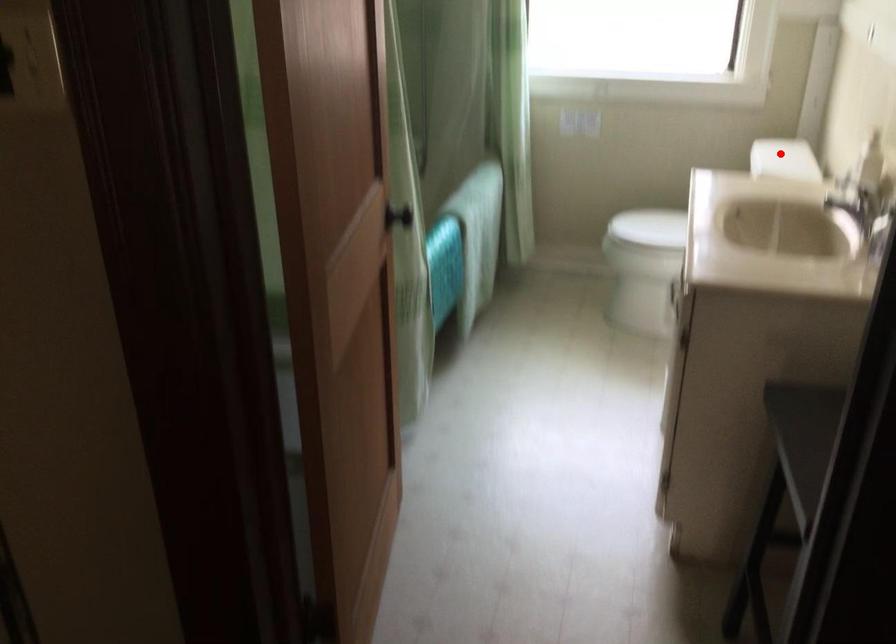
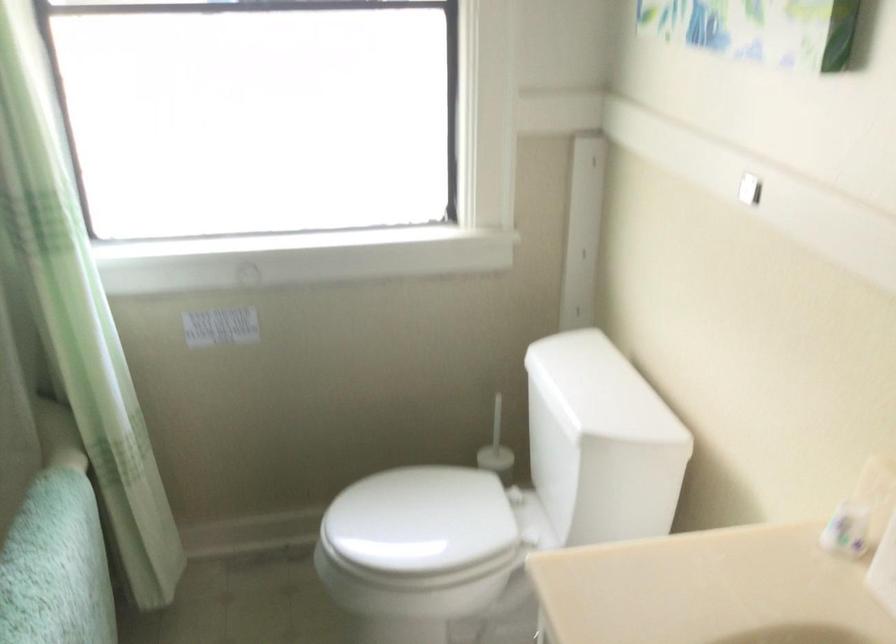
Question: I am providing you with two images of the same scene from different viewpoints. In image1, a red point is highlighted. Considering the same 3D point in image2, which of the following is correct?

Choices:
 (A) It is closer
 (B) It is farther

Answer: (A)